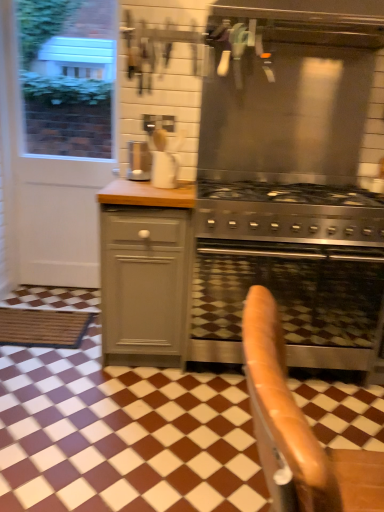
Identify the location of free spot in front of stainless steel oven at center. The image size is (384, 512). (244, 429).